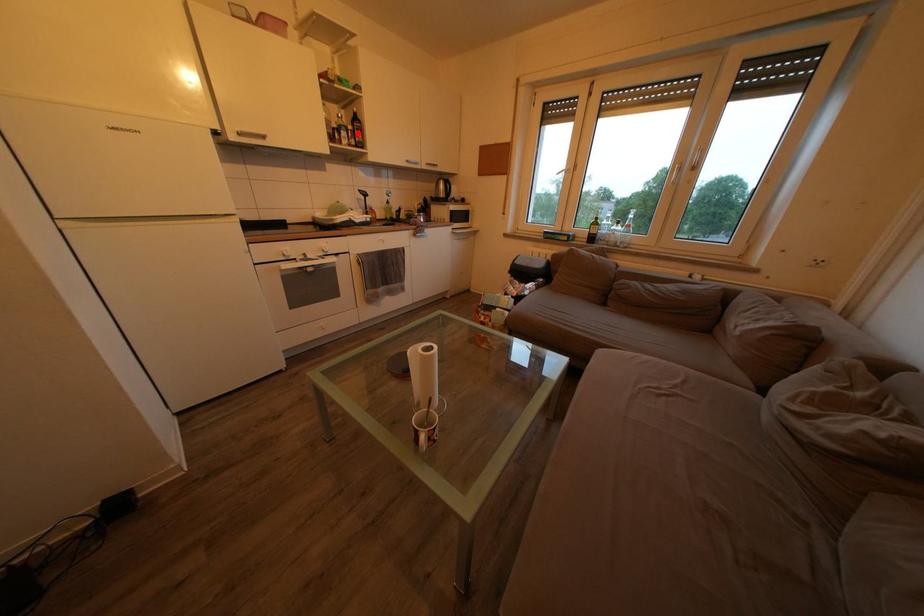
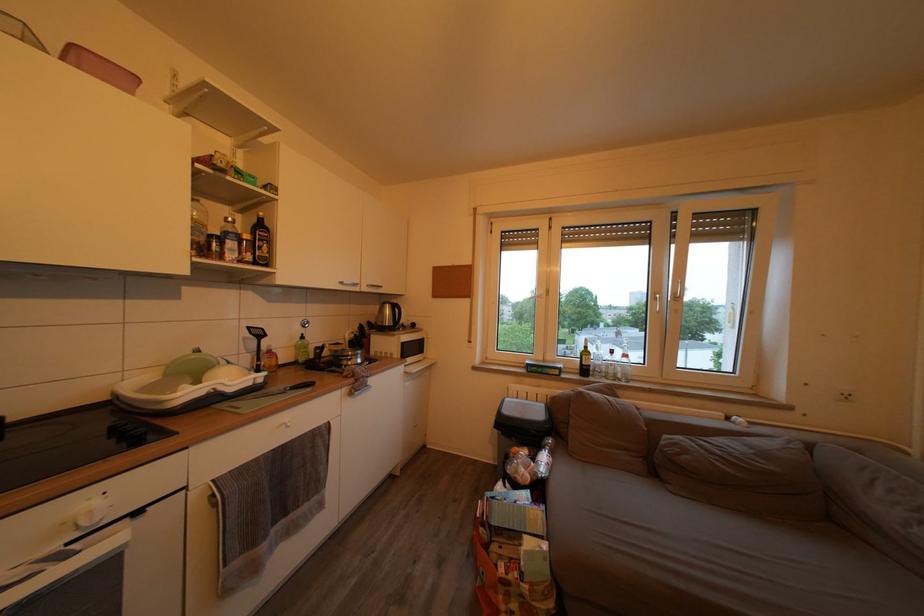
Question: I am providing you with two images of the same scene from different viewpoints. Image1 has a red point marked. In image2, the corresponding 3D location appears at what relative position? Reply with the corresponding letter.

Choices:
 (A) Closer
 (B) Farther

Answer: (B)